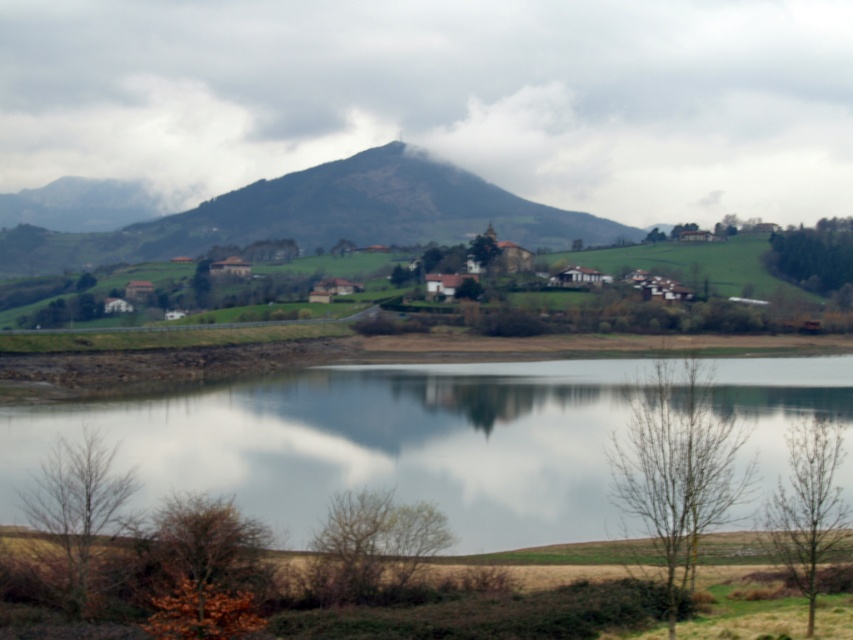
Question: Among these points, which one is nearest to the camera?

Choices:
 (A) (802, 276)
 (B) (402, 573)
 (C) (306, 524)
 (D) (259, 204)

Answer: (B)

Question: Which of the following is the farthest from the observer?

Choices:
 (A) (509, 524)
 (B) (637, 385)
 (C) (190, 524)

Answer: (A)

Question: Can you confirm if bare branches at lower center is bigger than green matte tree at center?

Choices:
 (A) no
 (B) yes

Answer: (A)

Question: Observing the image, what is the correct spatial positioning of green grassy hill at center in reference to green matte tree at center?

Choices:
 (A) right
 (B) left

Answer: (B)

Question: Is bare branches at center smaller than bare wood tree at lower right?

Choices:
 (A) no
 (B) yes

Answer: (A)

Question: Among these objects, which one is nearest to the camera?

Choices:
 (A) green matte tree at center
 (B) cloudy sky at center
 (C) brown leafy tree at lower left

Answer: (C)